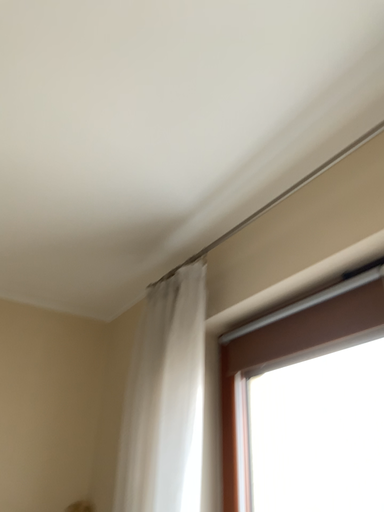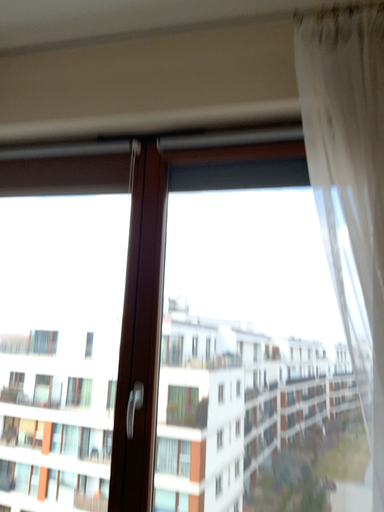
Question: How did the camera likely rotate when shooting the video?

Choices:
 (A) rotated left
 (B) rotated right

Answer: (B)